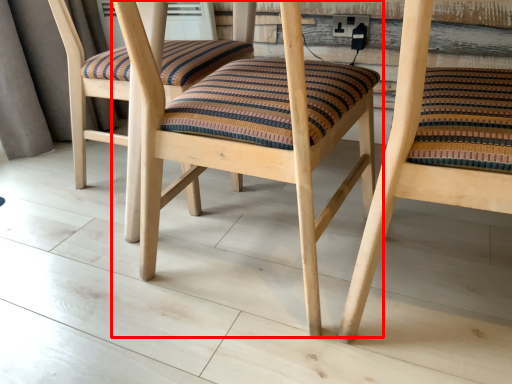
Question: Observing the image, what is the correct spatial positioning of chair (annotated by the red box) in reference to chair?

Choices:
 (A) right
 (B) left

Answer: (B)